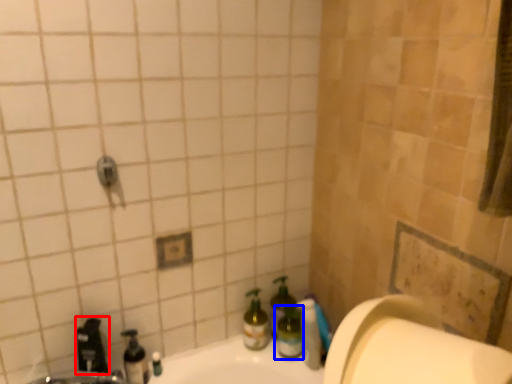
Question: Which object is further to the camera taking this photo, faucet (highlighted by a red box) or bottle (highlighted by a blue box)?

Choices:
 (A) faucet
 (B) bottle

Answer: (B)